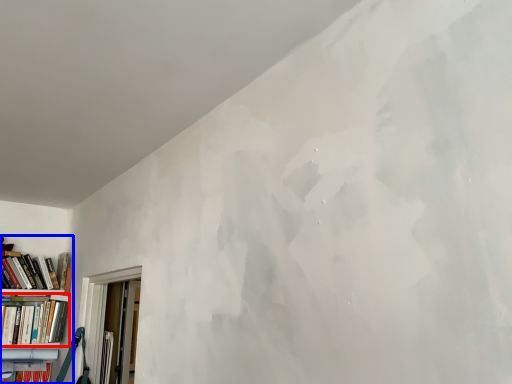
Question: Which object appears closest to the camera in this image, book (highlighted by a red box) or bookcase (highlighted by a blue box)?

Choices:
 (A) book
 (B) bookcase

Answer: (B)